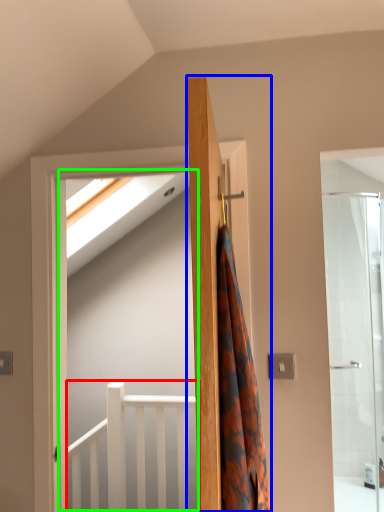
Question: Based on their relative distances, which object is farther from balustrade (highlighted by a red box)? Choose from door (highlighted by a blue box) and screen door (highlighted by a green box).

Choices:
 (A) door
 (B) screen door

Answer: (A)